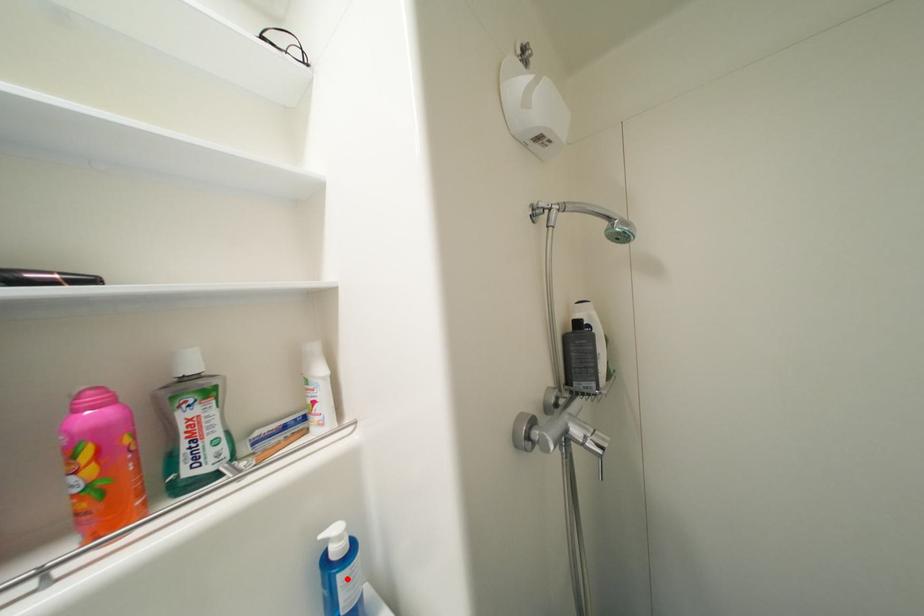
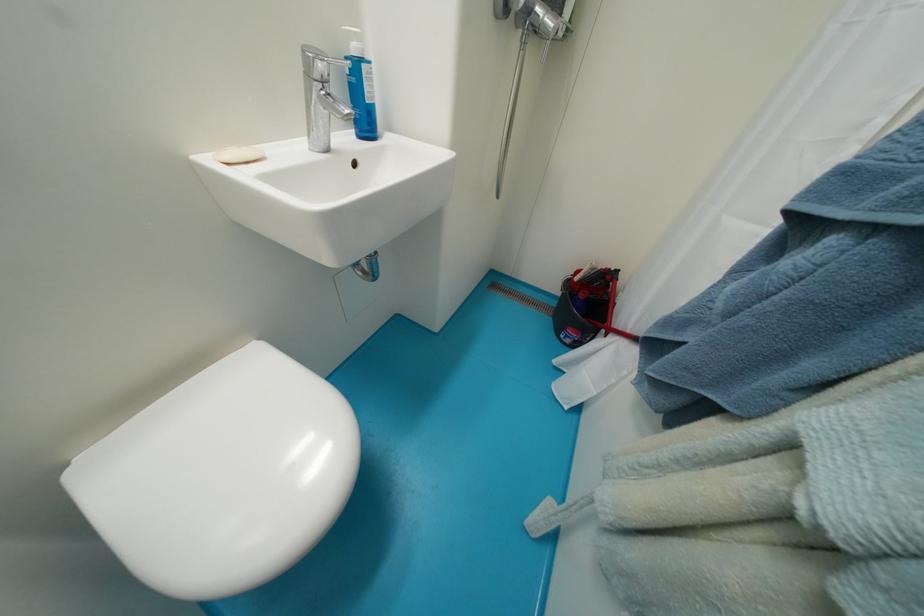
Find the pixel in the second image that matches the highlighted location in the first image.

(371, 70)